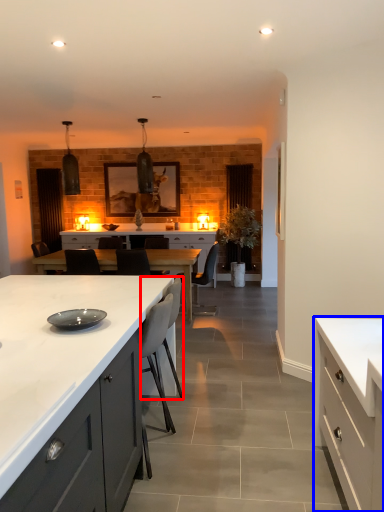
Question: Which of the following is the farthest to the observer, armchair (highlighted by a red box) or cabinetry (highlighted by a blue box)?

Choices:
 (A) armchair
 (B) cabinetry

Answer: (A)